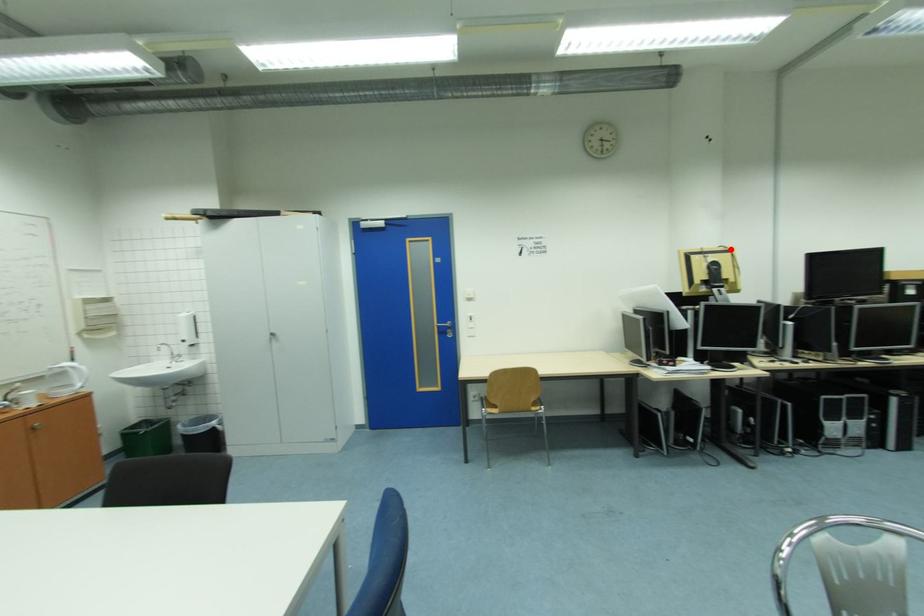
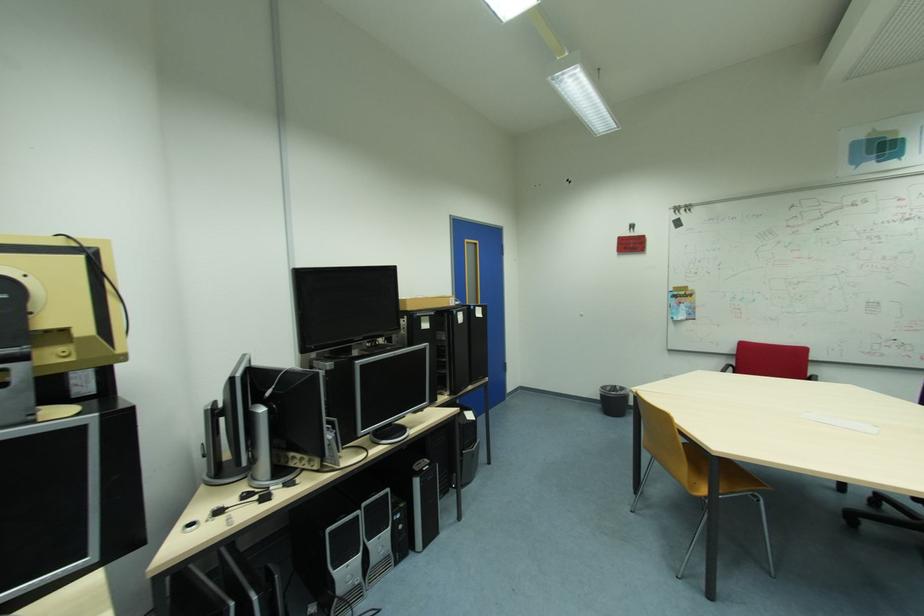
Question: I am providing you with two images of the same scene from different viewpoints. A red point is marked on the first image. Is the red point's position out of view in image 2?

Choices:
 (A) Yes
 (B) No

Answer: (B)